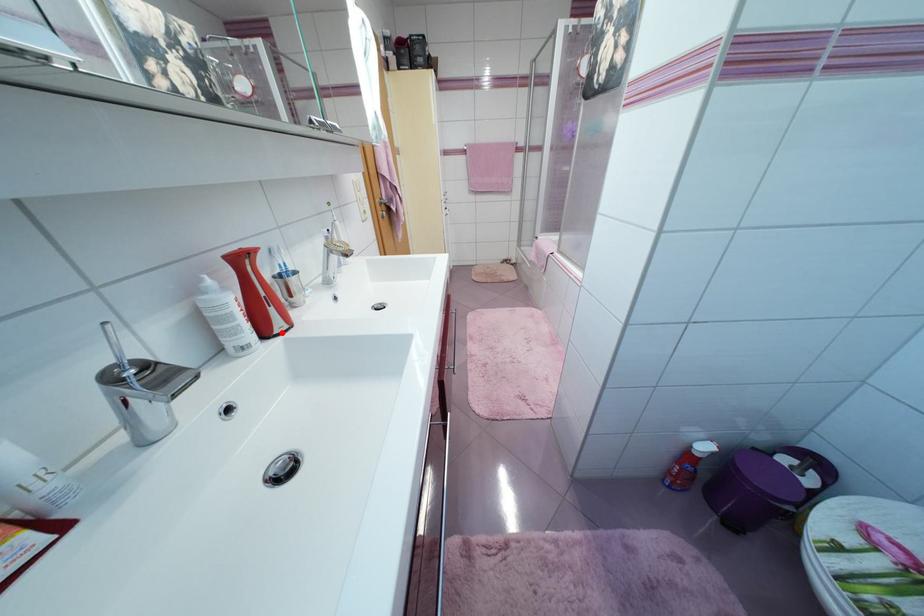
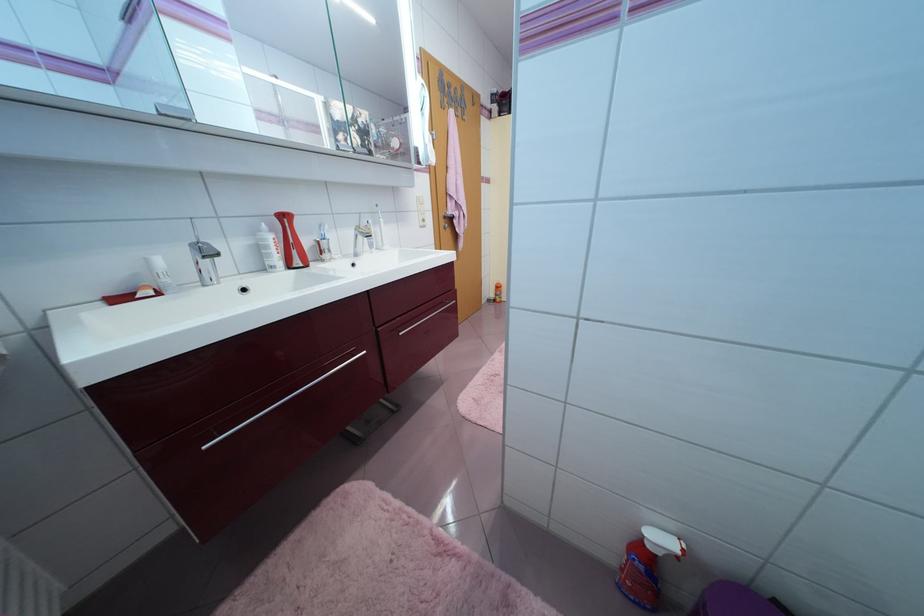
Find the pixel in the second image that matches the highlighted location in the first image.

(299, 267)